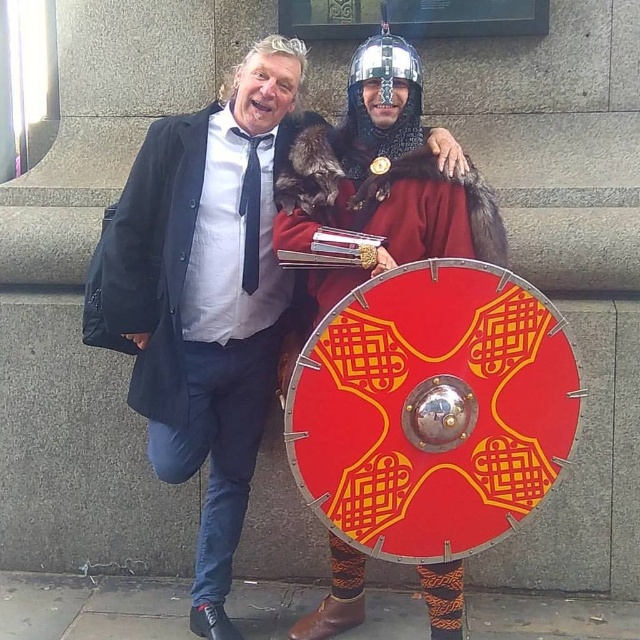
You are a photographer setting up for a group photo. You notice the matte red shield at center and the shiny silver helmet at center. Which object should you position closer to the camera to ensure both are fully visible in the frame?

The matte red shield at center is taller than the shiny silver helmet at center, so positioning the shield closer to the camera will help ensure both objects fit within the frame by reducing the shield height in the photo while keeping the helmet visible.

You are a photographer setting up for a group photo. You have two props to place between the two people in the scene. The props are a matte red shield at center and a shiny silver helmet at center. The minimum distance required between the props is 30 inches. Can you position them between the two people without violating the distance requirement?

The matte red shield at center and shiny silver helmet at center are 32.00 inches apart, which meets the minimum distance requirement of 30 inches. Therefore, you can position them between the two people without violating the distance requirement.